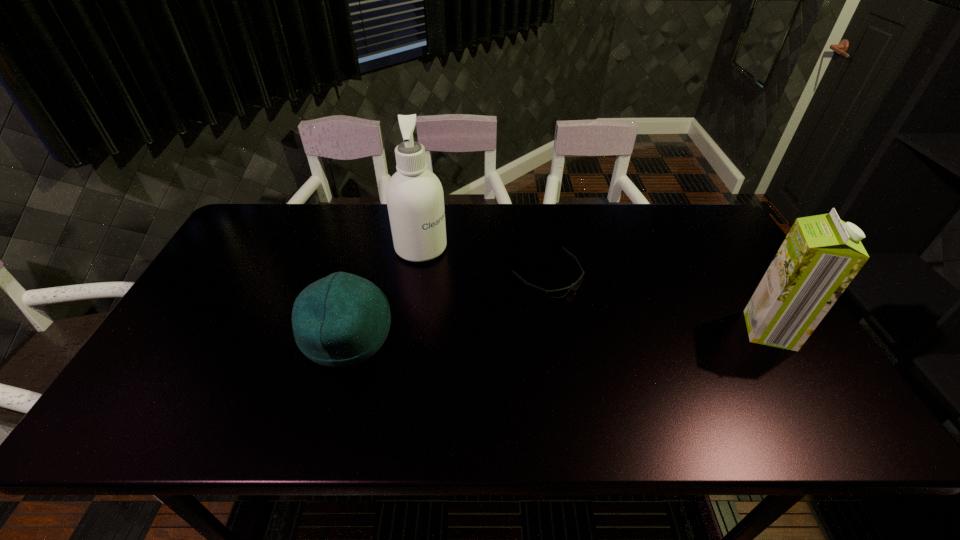
Locate an element on the screen. vacant area situated 0.060m on the front-facing side of the sunglasses is located at coordinates (586, 308).

Identify the location of vacant space located 0.330m on the front label of the tallest object. (536, 301).

Find the location of `blank space located 0.360m on the front label of the tallest object`. blank space located 0.360m on the front label of the tallest object is located at coordinates (545, 306).

Find the location of a particular element. vacant space situated 0.180m on the front label of the tallest object is located at coordinates (491, 280).

The width and height of the screenshot is (960, 540). I want to click on object at the far edge, so click(x=415, y=200).

The width and height of the screenshot is (960, 540). Identify the location of object at the near edge. (341, 320).

The width and height of the screenshot is (960, 540). I want to click on object that is positioned at the right edge, so click(820, 256).

You are a GUI agent. You are given a task and a screenshot of the screen. Output one action in this format:
    pyautogui.click(x=<x>, y=<y>)
    Task: Click on the vacant position at the far edge of the desktop
    Image resolution: width=960 pixels, height=540 pixels.
    Given the screenshot: What is the action you would take?
    pyautogui.click(x=509, y=217)

In the image, there is a desktop. Identify the location of vacant area at the near edge. (537, 364).

The width and height of the screenshot is (960, 540). In the image, there is a desktop. In order to click on vacant area at the left edge in this screenshot , I will do `click(217, 279)`.